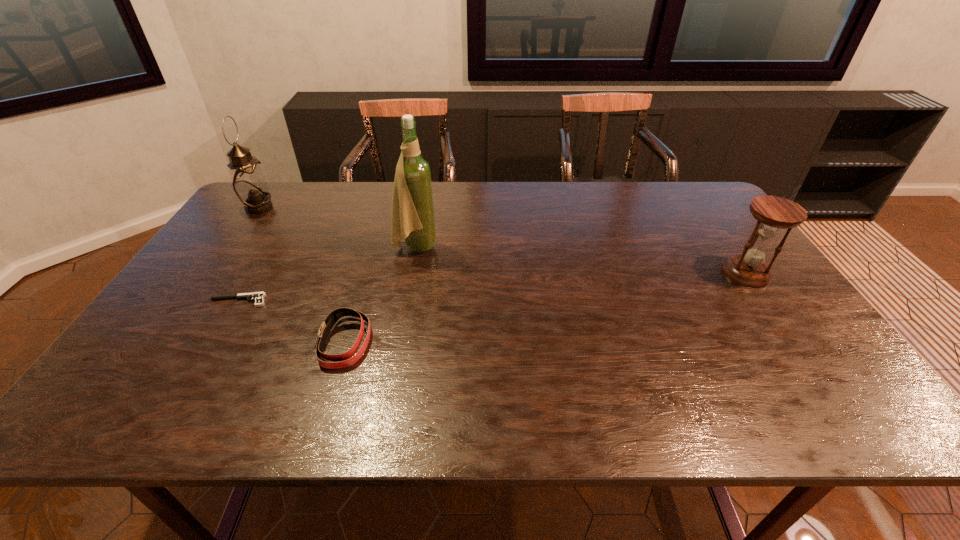
Locate an element on the screen. free space in the image that satisfies the following two spatial constraints: 1. on the front-facing side of the dog collar; 2. on the left side of the pistol is located at coordinates (215, 342).

Find the location of a particular element. Image resolution: width=960 pixels, height=540 pixels. free spot that satisfies the following two spatial constraints: 1. on the front-facing side of the wine bottle; 2. on the front side of the dog collar is located at coordinates (398, 342).

Locate an element on the screen. This screenshot has width=960, height=540. blank area in the image that satisfies the following two spatial constraints: 1. on the front-facing side of the second nearest object; 2. on the back side of the fourth tallest object is located at coordinates (215, 342).

The image size is (960, 540). What are the coordinates of `vacant space that satisfies the following two spatial constraints: 1. on the front-facing side of the dog collar; 2. on the right side of the shortest object` in the screenshot? It's located at (215, 342).

Locate an element on the screen. free space in the image that satisfies the following two spatial constraints: 1. on the back side of the second shortest object; 2. on the front-facing side of the shortest object is located at coordinates (357, 301).

Find the location of `vacant space that satisfies the following two spatial constraints: 1. on the front-facing side of the fourth object from left to right; 2. on the right side of the third shortest object`. vacant space that satisfies the following two spatial constraints: 1. on the front-facing side of the fourth object from left to right; 2. on the right side of the third shortest object is located at coordinates (411, 273).